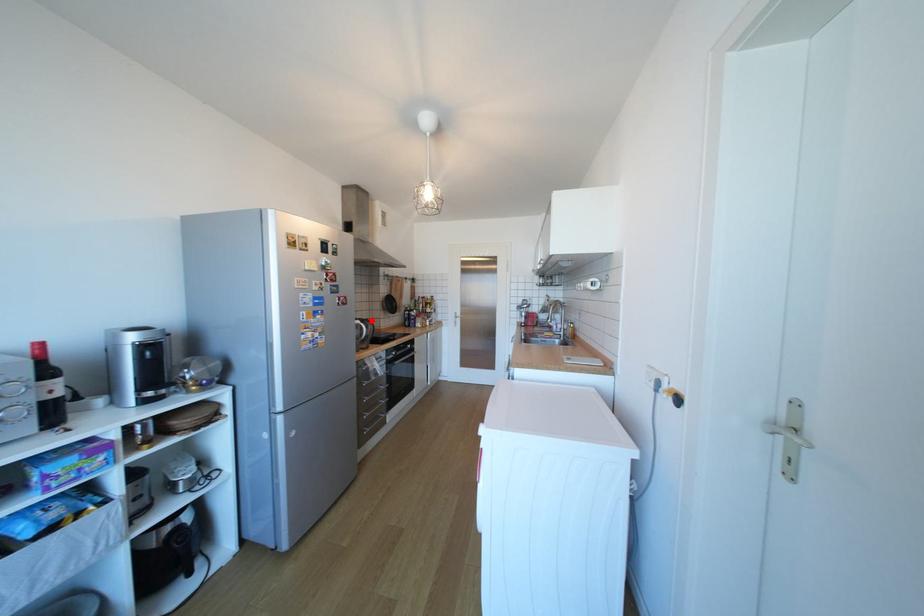
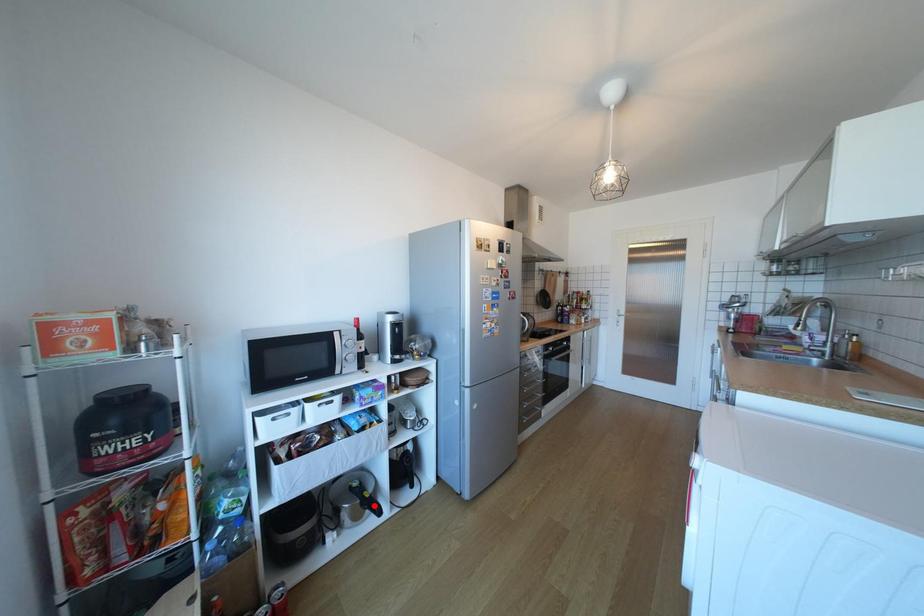
I am providing you with two images of the same scene from different viewpoints. A red point is marked on the first image and another point is marked on the second image. Is the red point in image1 aligned with the point shown in image2?

No